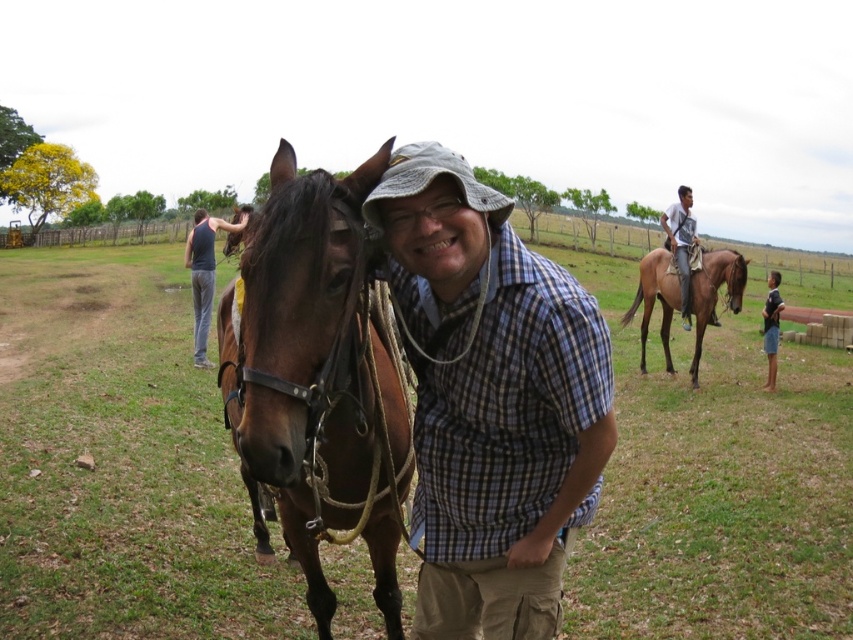
Question: Which point appears closest to the camera in this image?

Choices:
 (A) (206, 288)
 (B) (393, 401)

Answer: (B)

Question: Is matte plaid shirt at center smaller than brown glossy horse at right?

Choices:
 (A) yes
 (B) no

Answer: (A)

Question: Considering the relative positions of brown leather horse at center and black cotton shirt at lower right in the image provided, where is brown leather horse at center located with respect to black cotton shirt at lower right?

Choices:
 (A) below
 (B) above

Answer: (A)

Question: Which object is closer to the camera taking this photo?

Choices:
 (A) brown glossy horse at right
 (B) matte plaid shirt at center

Answer: (B)

Question: Which object appears closest to the camera in this image?

Choices:
 (A) brown glossy horse at right
 (B) black cotton shirt at lower right
 (C) dark gray tank top at left
 (D) matte plaid shirt at center

Answer: (D)

Question: Is matte plaid shirt at center positioned at the back of brown glossy horse at right?

Choices:
 (A) yes
 (B) no

Answer: (B)